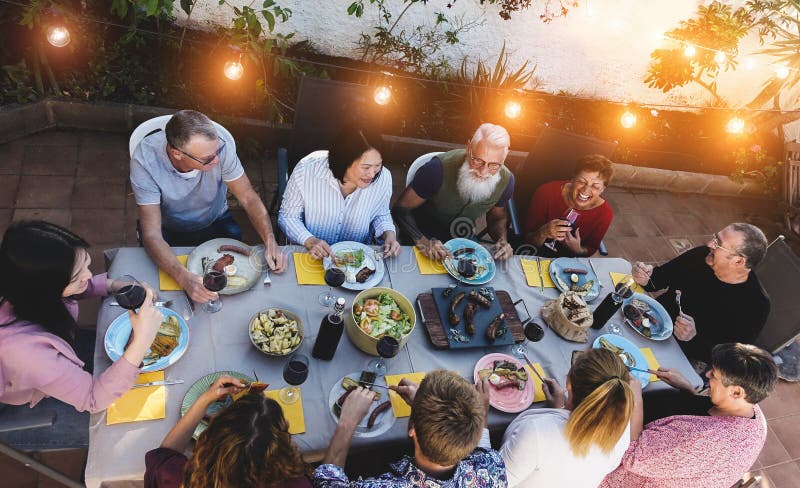
Image resolution: width=800 pixels, height=488 pixels. What are the coordinates of `serving vessels` in the screenshot? It's located at (296, 336), (350, 317), (445, 331), (554, 320).